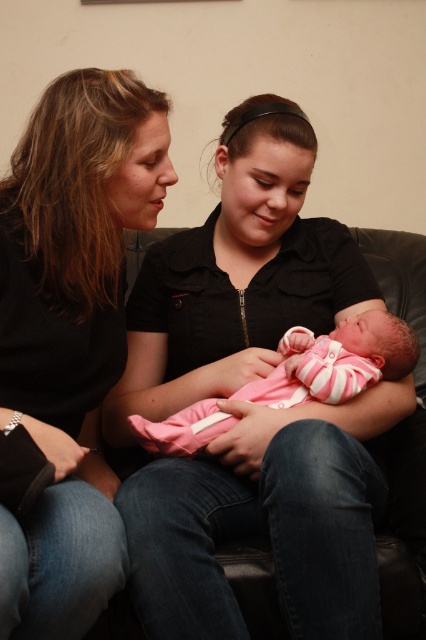
Question: Does pink matte fabric baby at center come in front of pink striped fabric newborn at center?

Choices:
 (A) yes
 (B) no

Answer: (A)

Question: Does matte black shirt at upper left appear on the right side of pink striped fabric newborn at center?

Choices:
 (A) yes
 (B) no

Answer: (B)

Question: Can you confirm if pink matte fabric baby at center is smaller than matte black shirt at upper left?

Choices:
 (A) yes
 (B) no

Answer: (B)

Question: Which of the following is the closest to the observer?

Choices:
 (A) (212, 429)
 (B) (40, 120)
 (C) (382, 497)

Answer: (B)

Question: Which point is closer to the camera?

Choices:
 (A) (293, 522)
 (B) (388, 333)

Answer: (A)

Question: Which point appears farthest from the camera in this image?

Choices:
 (A) (48, 221)
 (B) (172, 420)

Answer: (B)